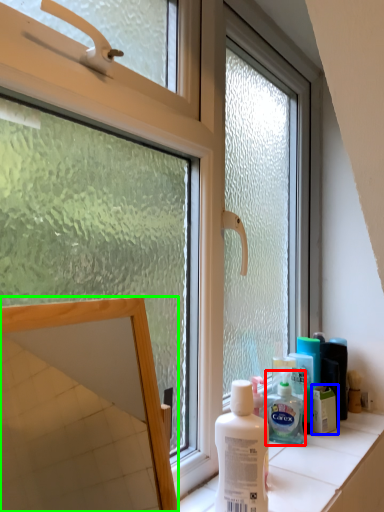
Question: Which is nearer to the shaving cream (highlighted by a red box)? product (highlighted by a blue box) or mirror (highlighted by a green box).

Choices:
 (A) product
 (B) mirror

Answer: (A)